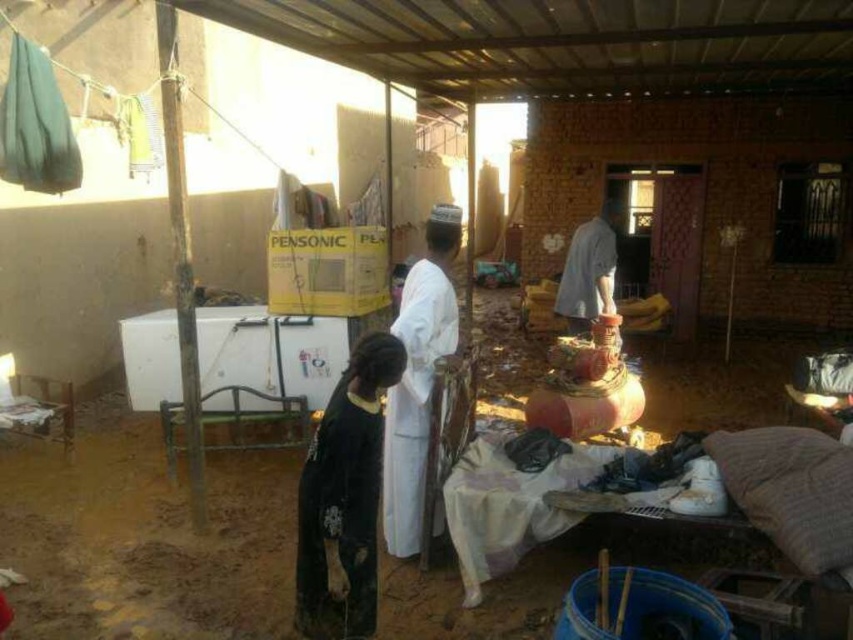
Between black matte robe at lower left and white matte robe at center, which one appears on the right side from the viewer's perspective?

white matte robe at center

Who is more forward, (318, 483) or (415, 403)?

Positioned in front is point (318, 483).

What do you see at coordinates (339, 518) in the screenshot?
I see `black matte robe at lower left` at bounding box center [339, 518].

Where is `black matte robe at lower left`? black matte robe at lower left is located at coordinates (339, 518).

Who is more distant from viewer, (312,492) or (583,320)?

The point (583,320) is more distant.

Find the location of a particular element. This screenshot has width=853, height=640. black matte robe at lower left is located at coordinates (339, 518).

Does white matte robe at center have a greater width compared to dark gray fabric shirt at center right?

Incorrect, white matte robe at center's width does not surpass dark gray fabric shirt at center right's.

Identify the location of white matte robe at center. (415, 400).